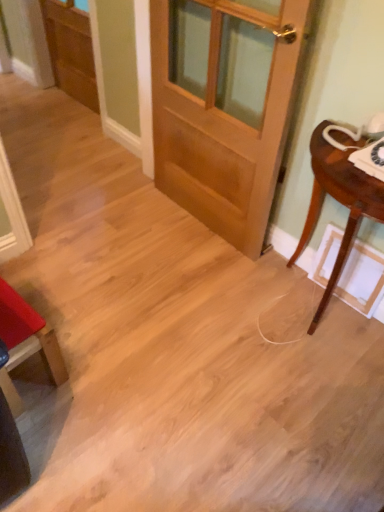
Find the location of a particular element. This screenshot has height=512, width=384. vacant space situated on the left part of mahogany wood table at right is located at coordinates (221, 317).